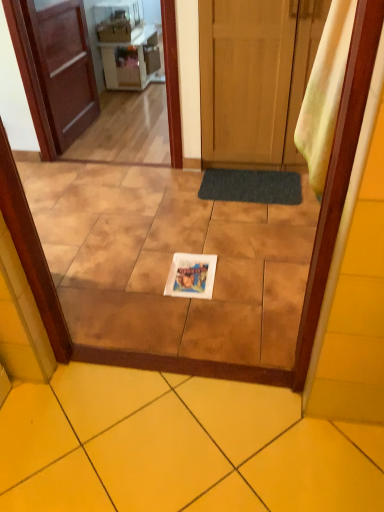
At what (x,y) coordinates should I click in order to perform the action: click on free location in front of brown wooden screen door at upper left. Please return your answer as a coordinate pair (x, y). Looking at the image, I should click on (105, 197).